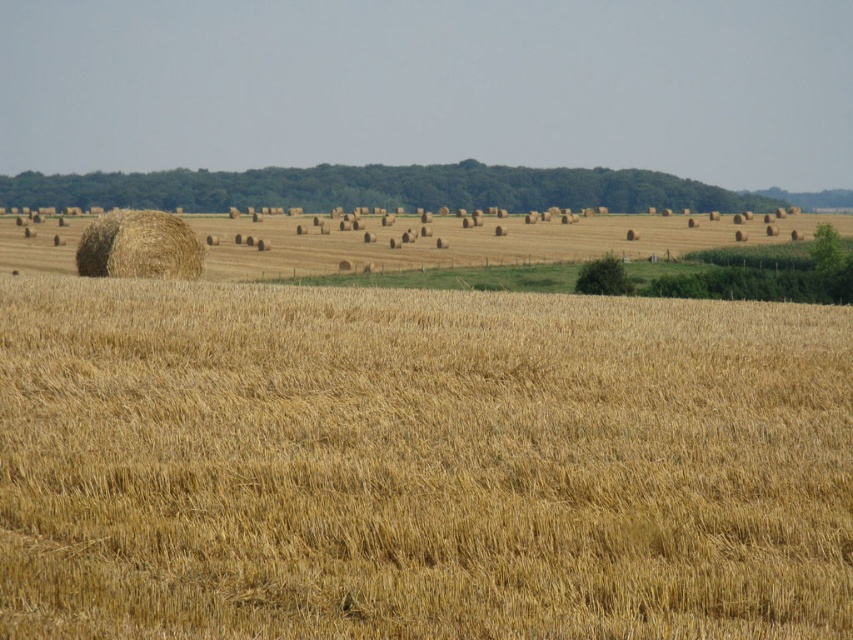
Is point (834, 608) positioned in front of point (704, 234)?

Yes.

Find the location of a particular element. This screenshot has width=853, height=640. dry straw at center is located at coordinates (419, 464).

Is golden straw bale at left thinner than golden straw bale at center?

No, golden straw bale at left is not thinner than golden straw bale at center.

From the picture: Does golden straw bale at left come in front of golden straw bale at center?

No, golden straw bale at left is further to the viewer.

Which is in front, point (332, 250) or point (172, 243)?

Point (172, 243) is in front.

This screenshot has height=640, width=853. In order to click on golden straw bale at left in this screenshot , I will do `click(473, 241)`.

Between point (341, 616) and point (149, 269), which one is positioned behind?

The point (149, 269) is more distant.

Is point (120, 492) positioned in front of point (129, 248)?

That is True.

Where is `dry straw at center`? dry straw at center is located at coordinates tap(419, 464).